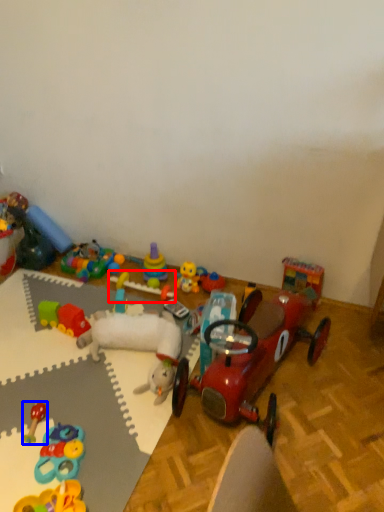
Question: Which point is closer to the camera, toy (highlighted by a red box) or toy (highlighted by a blue box)?

Choices:
 (A) toy
 (B) toy

Answer: (B)